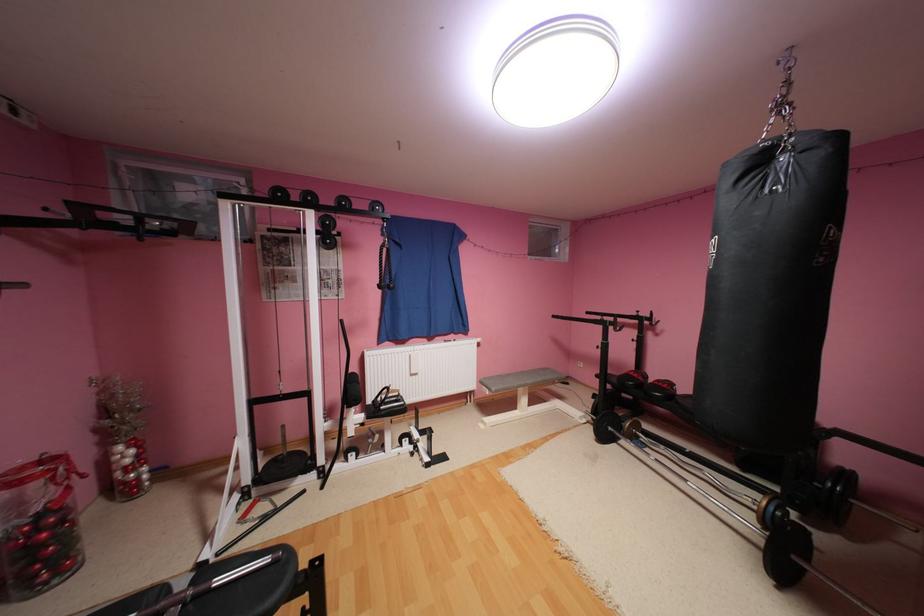
What do you see at coordinates (414, 363) in the screenshot? I see `the white radiator knob` at bounding box center [414, 363].